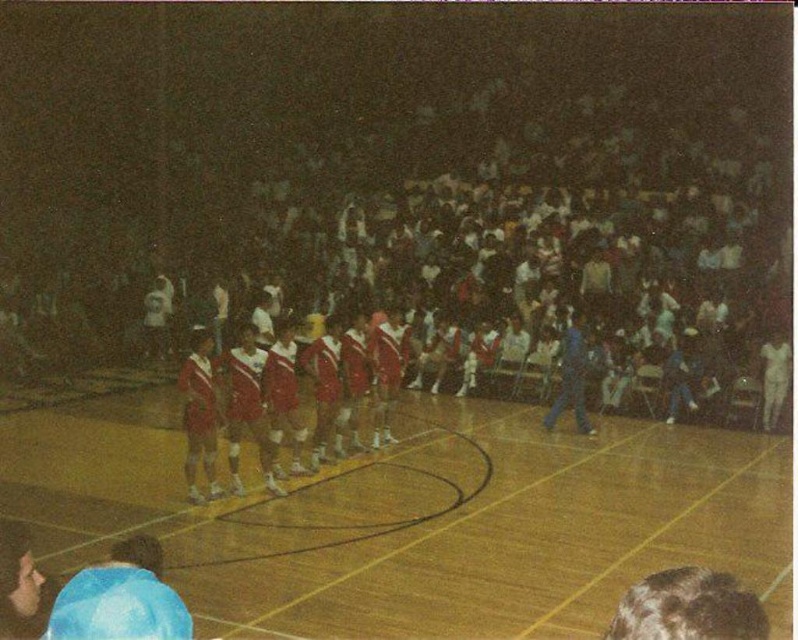
Question: Is wooden basketball court at center to the left of red shiny uniform at center from the viewer's perspective?

Choices:
 (A) yes
 (B) no

Answer: (B)

Question: Among these objects, which one is nearest to the camera?

Choices:
 (A) wooden basketball court at center
 (B) red shiny uniform at center

Answer: (A)

Question: Does wooden basketball court at center appear on the right side of red shiny uniform at center?

Choices:
 (A) no
 (B) yes

Answer: (B)

Question: Can you confirm if wooden basketball court at center is bigger than red shiny uniform at center?

Choices:
 (A) no
 (B) yes

Answer: (B)